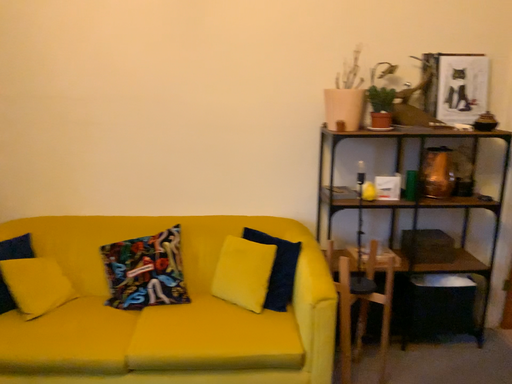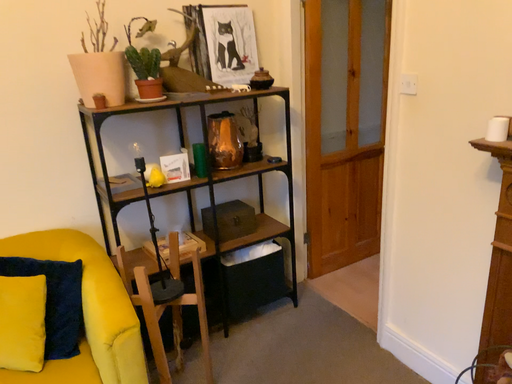
Question: How did the camera likely rotate when shooting the video?

Choices:
 (A) rotated left
 (B) rotated right

Answer: (B)